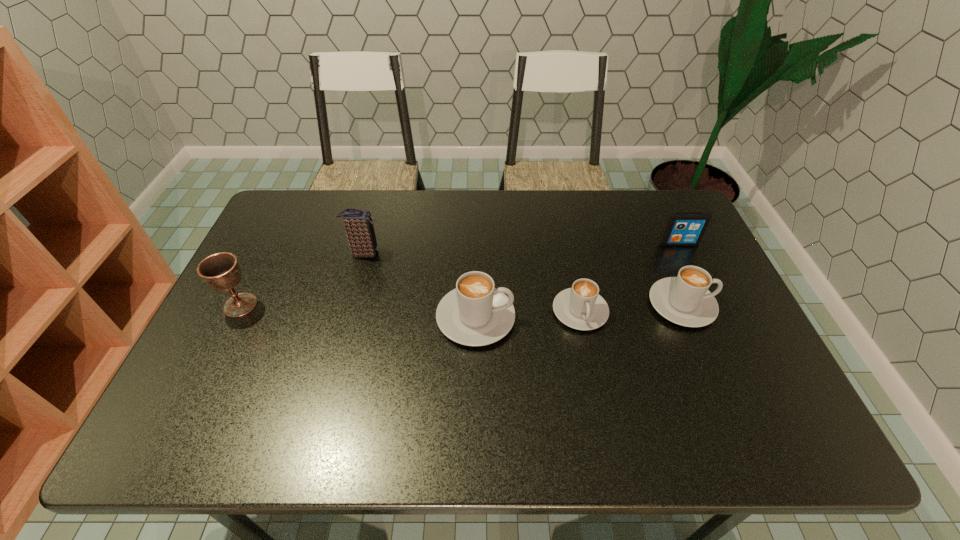
With all cappuccinos evenly spaced, where should an extra cappuccino be placed on the left to continue the pattern? Please point out a vacant space. Please provide its 2D coordinates. Your answer should be formatted as a tuple, i.e. [(x, y)], where the tuple contains the x and y coordinates of a point satisfying the conditions above.

[(369, 325)]